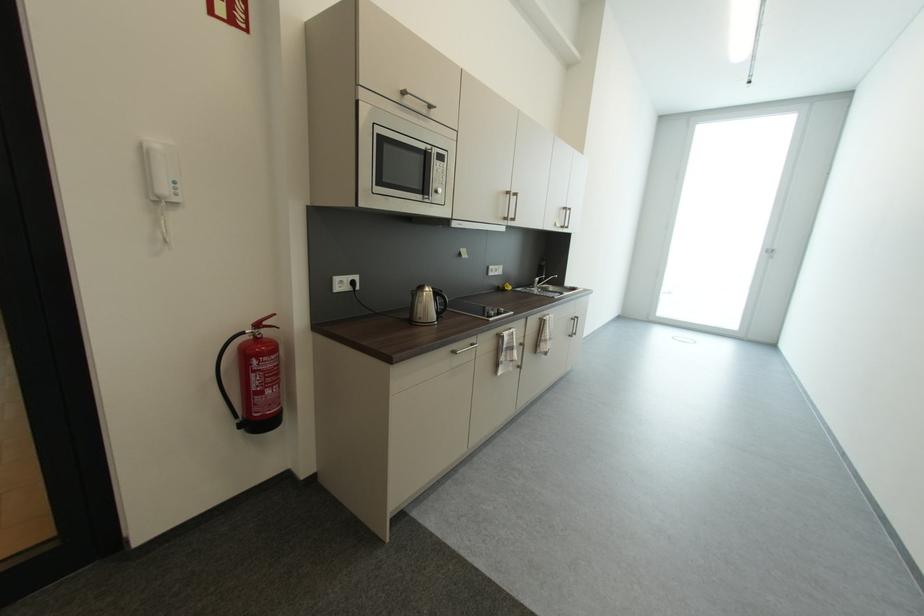
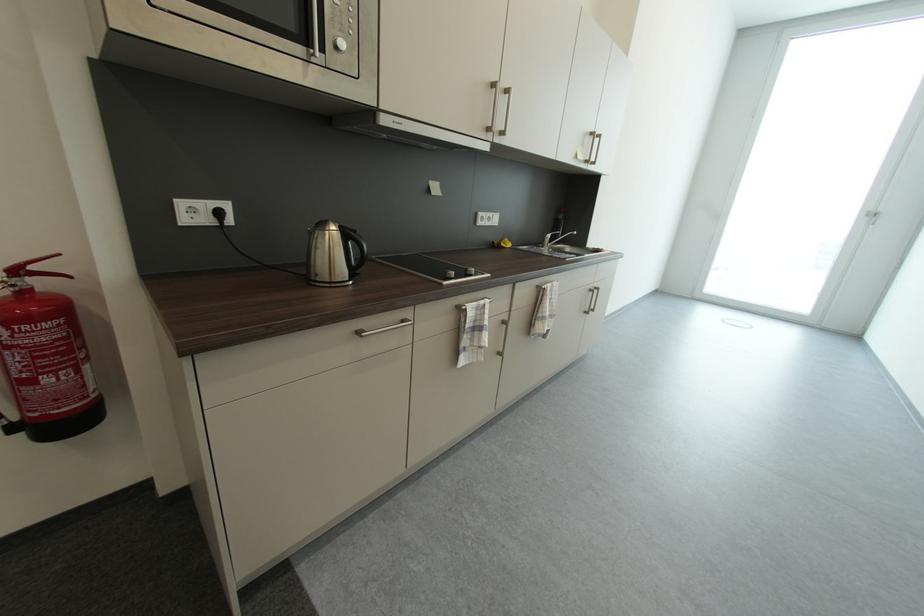
In the second image, find the point that corresponds to point 774,253 in the first image.

(878, 217)